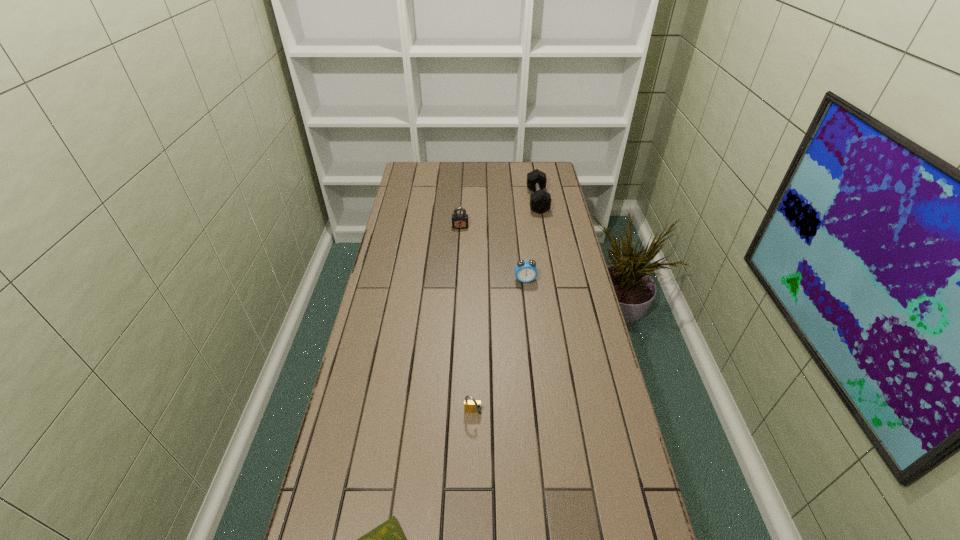
Identify the location of empty space between the third nearest object and the dumbbell. This screenshot has height=540, width=960. (531, 240).

At what (x,y) coordinates should I click in order to perform the action: click on empty space between the alarm clock and the rightmost object. Please return your answer as a coordinate pair (x, y). Looking at the image, I should click on (531, 240).

Find the location of a particular element. The width and height of the screenshot is (960, 540). free space between the dumbbell and the shorter padlock is located at coordinates (505, 307).

What are the coordinates of `empty space between the farthest object and the farther padlock` in the screenshot? It's located at (499, 213).

At what (x,y) coordinates should I click in order to perform the action: click on object that stands as the closest to the farthest object. Please return your answer as a coordinate pair (x, y). This screenshot has height=540, width=960. Looking at the image, I should click on (459, 221).

Image resolution: width=960 pixels, height=540 pixels. I want to click on object that is the fourth closest to the nearer padlock, so click(540, 201).